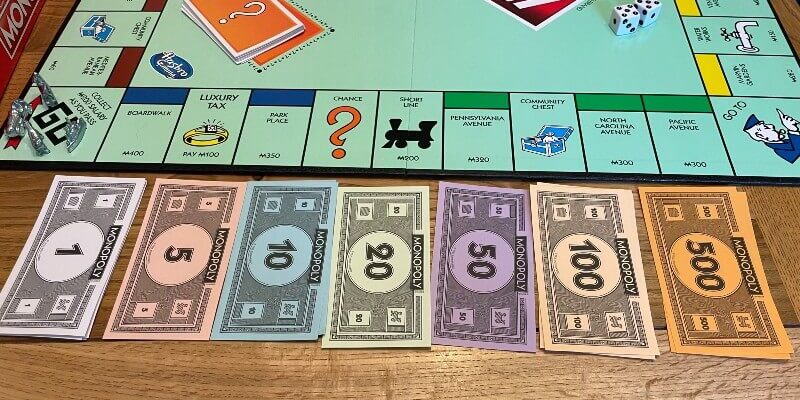
The width and height of the screenshot is (800, 400). What are the coordinates of `monopoly money` in the screenshot? It's located at (69, 244), (162, 260), (280, 239), (365, 246), (464, 257), (600, 267), (714, 264).